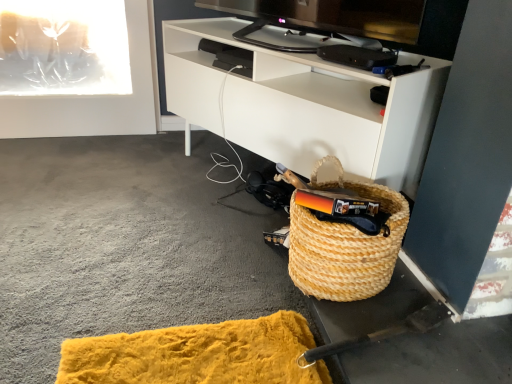
Question: From a real-world perspective, is white matte cabinet at lower right on natural woven basket at lower right?

Choices:
 (A) yes
 (B) no

Answer: (A)

Question: Considering the relative sizes of white matte cabinet at lower right and natural woven basket at lower right in the image provided, is white matte cabinet at lower right wider than natural woven basket at lower right?

Choices:
 (A) yes
 (B) no

Answer: (A)

Question: Is white matte cabinet at lower right turned away from natural woven basket at lower right?

Choices:
 (A) yes
 (B) no

Answer: (B)

Question: Does white matte cabinet at lower right contain natural woven basket at lower right?

Choices:
 (A) no
 (B) yes

Answer: (A)

Question: Are white matte cabinet at lower right and natural woven basket at lower right located far from each other?

Choices:
 (A) no
 (B) yes

Answer: (A)

Question: Is white matte cabinet at lower right smaller than natural woven basket at lower right?

Choices:
 (A) yes
 (B) no

Answer: (B)

Question: Can white matte cabinet at lower right be found inside natural woven basket at lower right?

Choices:
 (A) no
 (B) yes

Answer: (A)

Question: Can you confirm if natural woven basket at lower right is positioned to the left of white matte cabinet at lower right?

Choices:
 (A) no
 (B) yes

Answer: (A)

Question: From the image's perspective, is natural woven basket at lower right beneath white matte cabinet at lower right?

Choices:
 (A) no
 (B) yes

Answer: (B)

Question: Is natural woven basket at lower right in front of white matte cabinet at lower right?

Choices:
 (A) yes
 (B) no

Answer: (A)

Question: Is natural woven basket at lower right facing towards white matte cabinet at lower right?

Choices:
 (A) yes
 (B) no

Answer: (B)

Question: Does natural woven basket at lower right have a greater height compared to white matte cabinet at lower right?

Choices:
 (A) no
 (B) yes

Answer: (A)

Question: Do you think natural woven basket at lower right is within white matte cabinet at lower right, or outside of it?

Choices:
 (A) inside
 (B) outside

Answer: (B)